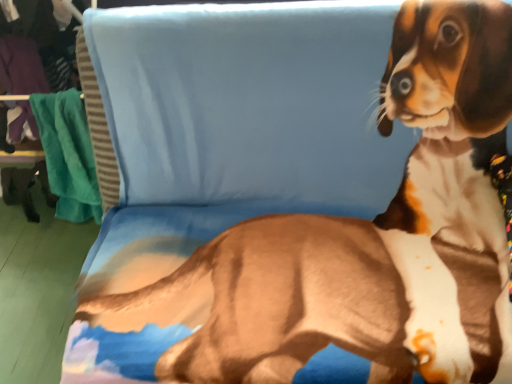
Where is `green fabric at left`? green fabric at left is located at coordinates (39, 51).

This screenshot has height=384, width=512. Describe the element at coordinates (39, 51) in the screenshot. I see `green fabric at left` at that location.

At what (x,y) coordinates should I click in order to perform the action: click on green fabric at left. Please return your answer as a coordinate pair (x, y). The image size is (512, 384). Looking at the image, I should click on (39, 51).